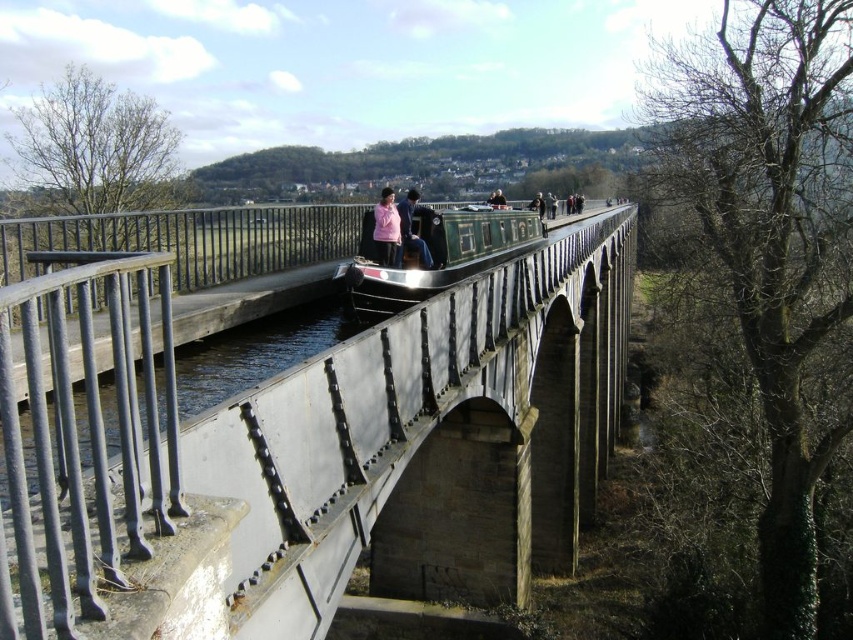
Question: Among these points, which one is nearest to the camera?

Choices:
 (A) (111, 552)
 (B) (379, 300)
 (C) (410, 211)
 (D) (20, 534)

Answer: (D)

Question: Which of the following is the closest to the observer?

Choices:
 (A) (419, 246)
 (B) (396, 264)
 (C) (488, 214)

Answer: (B)

Question: Does smooth concrete bridge at center have a larger size compared to pink fabric jacket at center?

Choices:
 (A) yes
 (B) no

Answer: (A)

Question: Among these objects, which one is farthest from the camera?

Choices:
 (A) green polished wood boat at center
 (B) smooth concrete bridge at center
 (C) matte pink jacket at center
 (D) pink fabric jacket at center

Answer: (C)

Question: Can you confirm if pink fabric jacket at center is smaller than matte pink jacket at center?

Choices:
 (A) yes
 (B) no

Answer: (A)

Question: Is pink fabric jacket at center to the right of matte pink jacket at center from the viewer's perspective?

Choices:
 (A) yes
 (B) no

Answer: (A)